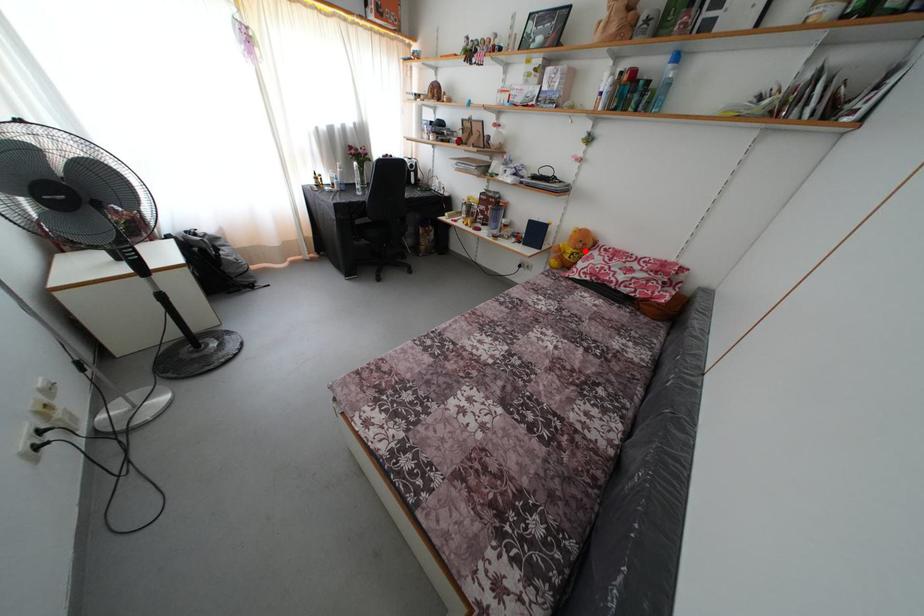
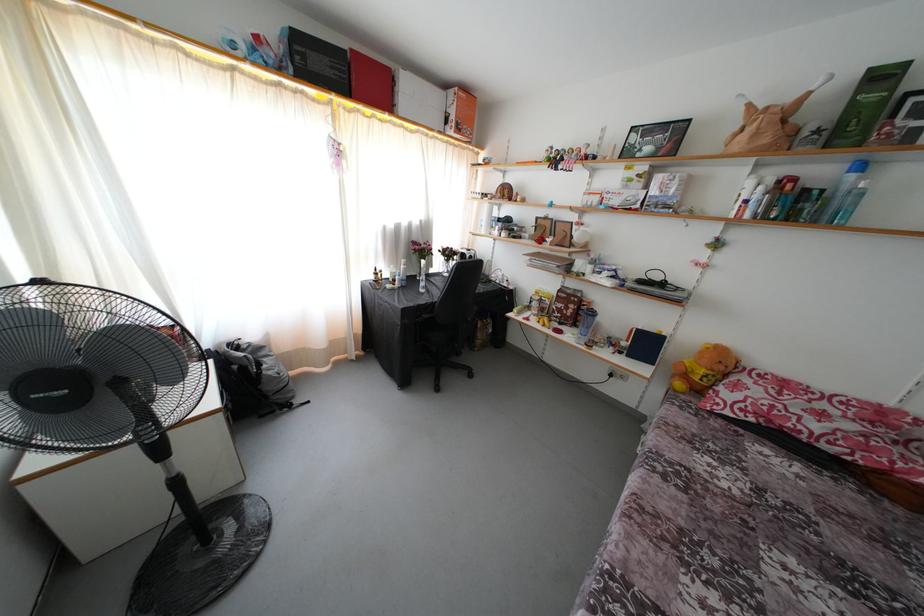
Question: I am providing you with two images of the same scene from different viewpoints. In image1, a red point is highlighted. Considering the same 3D point in image2, which of the following is correct?

Choices:
 (A) It is closer
 (B) It is farther

Answer: (B)